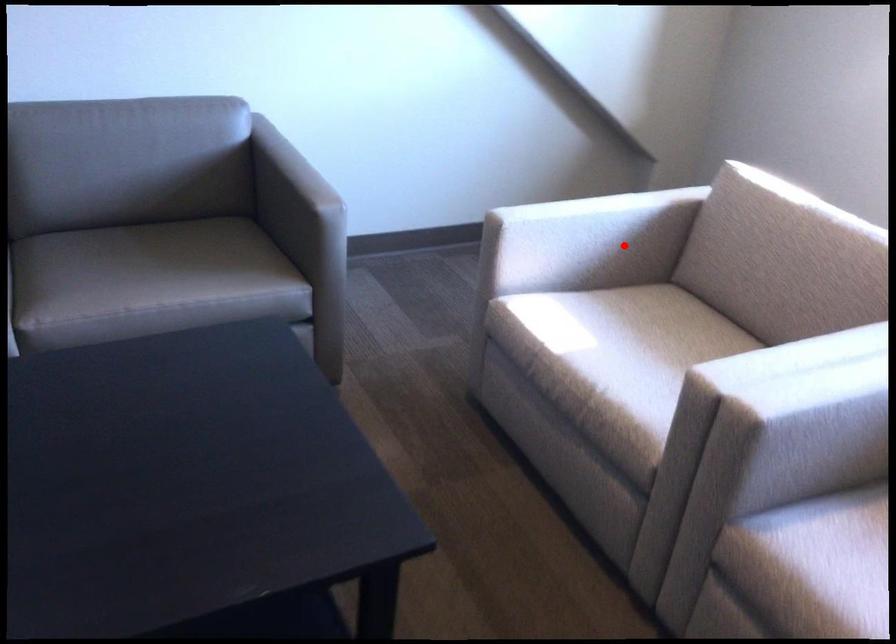
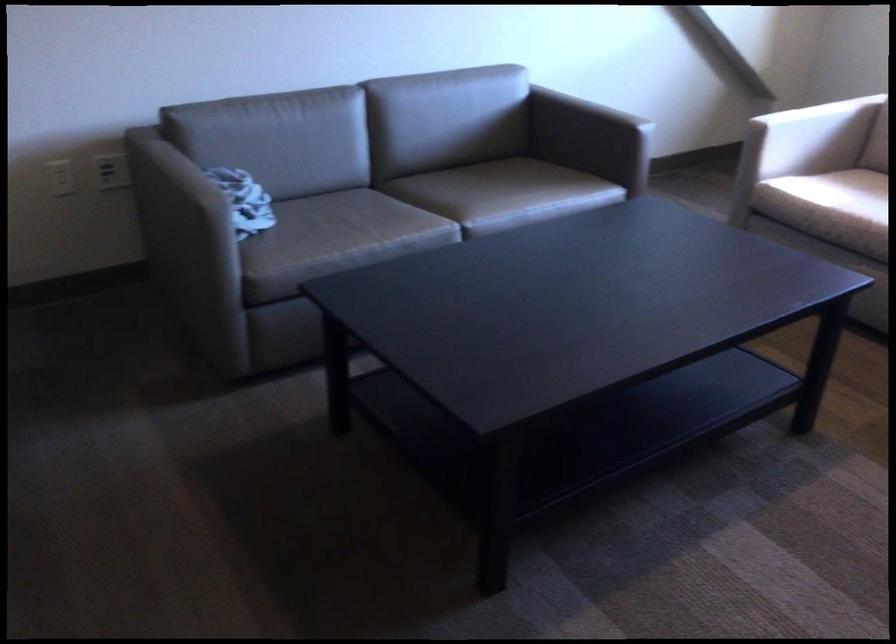
Find the pixel in the second image that matches the highlighted location in the first image.

(824, 137)